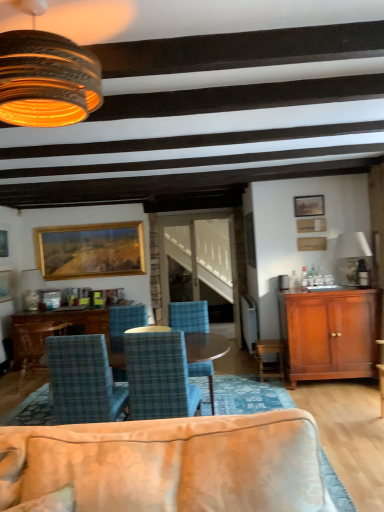
Question: Does wooden table at center touch wooden picture frame at upper right, placed as the second picture frame when sorted from front to back?

Choices:
 (A) no
 (B) yes

Answer: (A)

Question: From the image's perspective, would you say wooden table at center is positioned over wooden picture frame at upper right, which appears as the third picture frame when viewed from the back?

Choices:
 (A) no
 (B) yes

Answer: (A)

Question: Can you confirm if wooden table at center is thinner than wooden picture frame at upper right, which appears as the third picture frame when viewed from the back?

Choices:
 (A) yes
 (B) no

Answer: (B)

Question: Is wooden table at center positioned far away from wooden picture frame at upper right, placed as the second picture frame when sorted from front to back?

Choices:
 (A) yes
 (B) no

Answer: (A)

Question: Is wooden table at center taller than wooden picture frame at upper right, which appears as the third picture frame when viewed from the back?

Choices:
 (A) yes
 (B) no

Answer: (A)

Question: In terms of width, does wooden table at center look wider or thinner when compared to blue plaid chair at center, which ranks as the 2th chair in right-to-left order?

Choices:
 (A) wide
 (B) thin

Answer: (A)

Question: From a real-world perspective, is wooden table at center positioned above or below blue plaid chair at center, the third chair viewed from the left?

Choices:
 (A) below
 (B) above

Answer: (A)

Question: Is wooden table at center taller or shorter than blue plaid chair at center, arranged as the fourth chair when viewed from the back?

Choices:
 (A) short
 (B) tall

Answer: (A)

Question: From the image's perspective, is wooden table at center located above or below blue plaid chair at center, which ranks as the 2th chair in right-to-left order?

Choices:
 (A) above
 (B) below

Answer: (B)

Question: Considering the positions of gold-framed painting at left, which is the 4th picture frame in right-to-left order, and gold wooden picture frame at upper left, marked as the 4th picture frame in a front-to-back arrangement, in the image, is gold-framed painting at left, which is the 4th picture frame in right-to-left order, taller or shorter than gold wooden picture frame at upper left, marked as the 4th picture frame in a front-to-back arrangement,?

Choices:
 (A) short
 (B) tall

Answer: (A)

Question: Would you say gold-framed painting at left, which is the first picture frame in left-to-right order, is inside or outside gold wooden picture frame at upper left, placed as the third picture frame when sorted from right to left?

Choices:
 (A) inside
 (B) outside

Answer: (B)

Question: From a real-world perspective, relative to gold wooden picture frame at upper left, placed as the third picture frame when sorted from right to left, is gold-framed painting at left, the second picture frame from the back, vertically above or below?

Choices:
 (A) below
 (B) above

Answer: (A)

Question: Considering their positions, is gold-framed painting at left, the second picture frame from the back, located in front of or behind gold wooden picture frame at upper left, placed as the third picture frame when sorted from right to left?

Choices:
 (A) behind
 (B) front

Answer: (B)

Question: Based on their positions, is rustic wood lampshade at upper left, the 2th lamp from the back, located to the left or right of wooden table at center?

Choices:
 (A) right
 (B) left

Answer: (A)

Question: In terms of size, does rustic wood lampshade at upper left, positioned as the 2th lamp in bottom-to-top order, appear bigger or smaller than wooden table at center?

Choices:
 (A) small
 (B) big

Answer: (A)